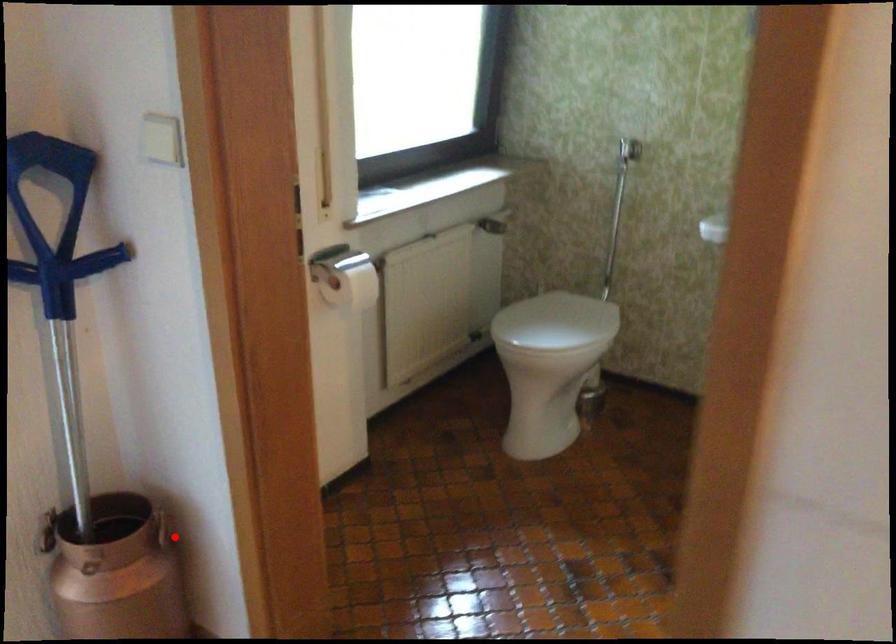
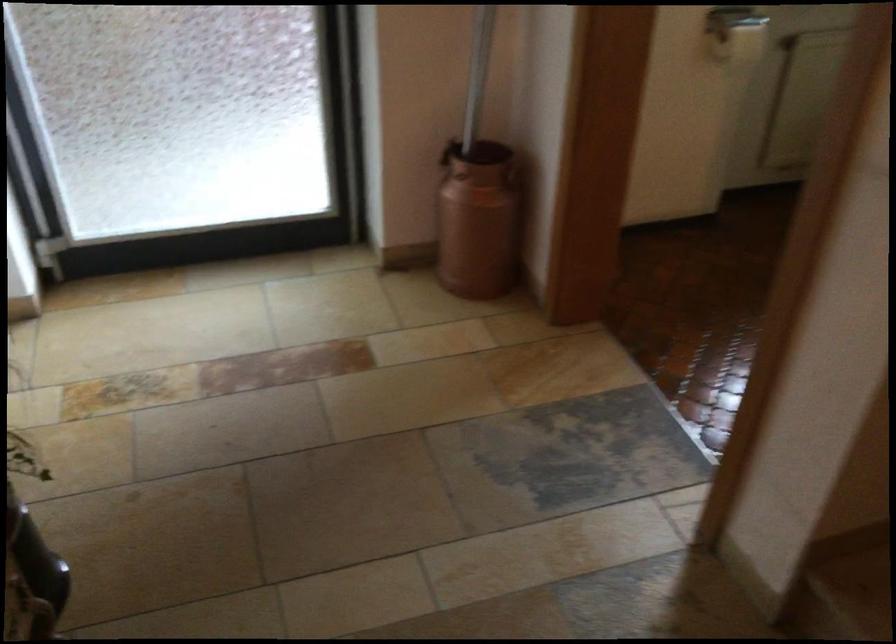
Locate, in the second image, the point that corresponds to the highlighted location in the first image.

(513, 176)